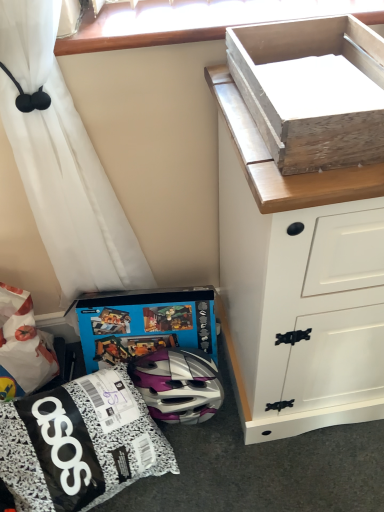
What are the coordinates of `empty space that is ontop of blue cardboard box at lower center` in the screenshot? It's located at (133, 305).